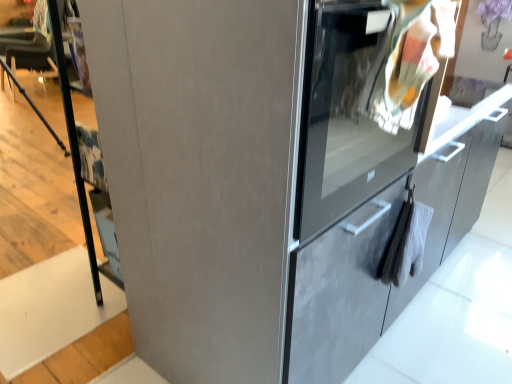
Question: Considering the relative sizes of satin gray cabinet at right and satin gray oven at right in the image provided, is satin gray cabinet at right smaller than satin gray oven at right?

Choices:
 (A) yes
 (B) no

Answer: (B)

Question: Is the surface of satin gray cabinet at right in direct contact with satin gray oven at right?

Choices:
 (A) no
 (B) yes

Answer: (A)

Question: Does satin gray cabinet at right turn towards satin gray oven at right?

Choices:
 (A) yes
 (B) no

Answer: (B)

Question: Does satin gray cabinet at right have a lesser height compared to satin gray oven at right?

Choices:
 (A) no
 (B) yes

Answer: (A)

Question: Can you confirm if satin gray cabinet at right is taller than satin gray oven at right?

Choices:
 (A) no
 (B) yes

Answer: (B)

Question: Does satin gray cabinet at right lie in front of satin gray oven at right?

Choices:
 (A) no
 (B) yes

Answer: (B)

Question: Can you confirm if satin gray oven at right is bigger than satin gray cabinet at right?

Choices:
 (A) no
 (B) yes

Answer: (A)

Question: Considering the relative sizes of satin gray oven at right and satin gray cabinet at right in the image provided, is satin gray oven at right taller than satin gray cabinet at right?

Choices:
 (A) no
 (B) yes

Answer: (A)

Question: Does satin gray oven at right have a lesser width compared to satin gray cabinet at right?

Choices:
 (A) yes
 (B) no

Answer: (B)

Question: Is satin gray oven at right smaller than satin gray cabinet at right?

Choices:
 (A) no
 (B) yes

Answer: (B)

Question: From a real-world perspective, is satin gray oven at right on satin gray cabinet at right?

Choices:
 (A) no
 (B) yes

Answer: (A)

Question: Considering the relative positions of satin gray oven at right and satin gray cabinet at right in the image provided, is satin gray oven at right to the right of satin gray cabinet at right from the viewer's perspective?

Choices:
 (A) yes
 (B) no

Answer: (B)

Question: Considering the relative sizes of white matte stair at lower left and satin gray cabinet at right in the image provided, is white matte stair at lower left shorter than satin gray cabinet at right?

Choices:
 (A) yes
 (B) no

Answer: (A)